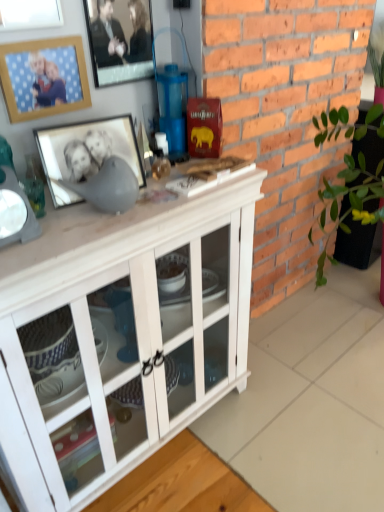
The height and width of the screenshot is (512, 384). I want to click on vacant area that is in front of matte black picture frame at upper left, which is the 3th picture frame from top to bottom, so click(x=82, y=229).